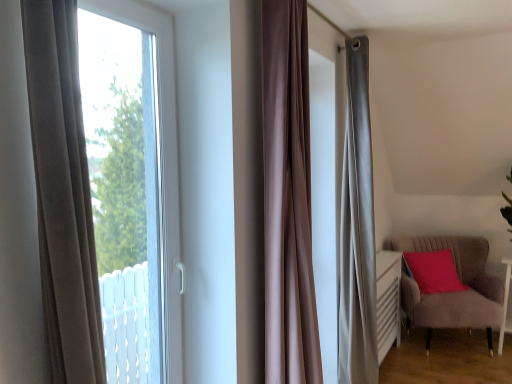
Question: Is matte pink cushion at right not inside satin brown curtain at center?

Choices:
 (A) no
 (B) yes

Answer: (B)

Question: Is matte pink cushion at right further to camera compared to satin brown curtain at center?

Choices:
 (A) no
 (B) yes

Answer: (B)

Question: Is matte pink cushion at right placed right next to satin brown curtain at center?

Choices:
 (A) no
 (B) yes

Answer: (A)

Question: From the image's perspective, is matte pink cushion at right beneath satin brown curtain at center?

Choices:
 (A) yes
 (B) no

Answer: (A)

Question: Is matte pink cushion at right far away from satin brown curtain at center?

Choices:
 (A) yes
 (B) no

Answer: (A)

Question: From the image's perspective, relative to satin brown curtain at center, is velvet grey armchair at lower right above or below?

Choices:
 (A) above
 (B) below

Answer: (B)

Question: Considering the positions of velvet grey armchair at lower right and satin brown curtain at center in the image, is velvet grey armchair at lower right wider or thinner than satin brown curtain at center?

Choices:
 (A) wide
 (B) thin

Answer: (A)

Question: Does point (412, 314) appear closer or farther from the camera than point (265, 97)?

Choices:
 (A) closer
 (B) farther

Answer: (B)

Question: Considering their positions, is velvet grey armchair at lower right located in front of or behind satin brown curtain at center?

Choices:
 (A) front
 (B) behind

Answer: (B)

Question: Considering the positions of transparent glass window at left and satin brown curtain at center in the image, is transparent glass window at left bigger or smaller than satin brown curtain at center?

Choices:
 (A) big
 (B) small

Answer: (B)

Question: Is transparent glass window at left wider or thinner than satin brown curtain at center?

Choices:
 (A) thin
 (B) wide

Answer: (B)

Question: In terms of height, does transparent glass window at left look taller or shorter compared to satin brown curtain at center?

Choices:
 (A) short
 (B) tall

Answer: (A)

Question: Does point coord(181,354) appear closer or farther from the camera than point coord(302,274)?

Choices:
 (A) farther
 (B) closer

Answer: (A)

Question: Does point (288, 223) appear closer or farther from the camera than point (487, 246)?

Choices:
 (A) farther
 (B) closer

Answer: (B)

Question: Which is correct: satin brown curtain at center is inside velvet grey armchair at lower right, or outside of it?

Choices:
 (A) outside
 (B) inside

Answer: (A)